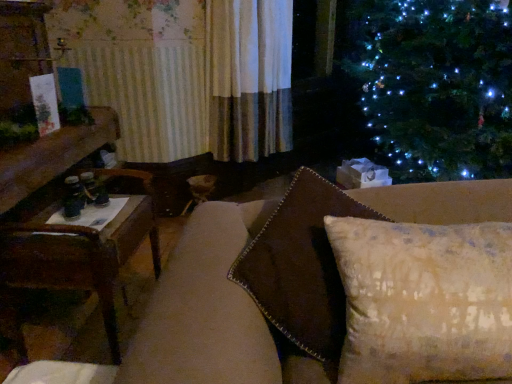
Question: Is textured beige pillow at center with brown wooden table at left?

Choices:
 (A) yes
 (B) no

Answer: (B)

Question: Is textured beige pillow at center to the left of brown wooden table at left from the viewer's perspective?

Choices:
 (A) no
 (B) yes

Answer: (A)

Question: Can you confirm if textured beige pillow at center is smaller than brown wooden table at left?

Choices:
 (A) no
 (B) yes

Answer: (B)

Question: Is textured beige pillow at center positioned with its back to brown wooden table at left?

Choices:
 (A) yes
 (B) no

Answer: (B)

Question: Does textured beige pillow at center have a greater width compared to brown wooden table at left?

Choices:
 (A) yes
 (B) no

Answer: (B)

Question: Would you consider textured beige pillow at center to be distant from brown wooden table at left?

Choices:
 (A) yes
 (B) no

Answer: (B)

Question: Considering the relative sizes of brown wooden table at left and textured beige pillow at center in the image provided, is brown wooden table at left wider than textured beige pillow at center?

Choices:
 (A) yes
 (B) no

Answer: (A)

Question: Is brown wooden table at left not close to textured beige pillow at center?

Choices:
 (A) no
 (B) yes

Answer: (A)

Question: Does brown wooden table at left have a lesser width compared to textured beige pillow at center?

Choices:
 (A) yes
 (B) no

Answer: (B)

Question: Is brown wooden table at left touching textured beige pillow at center?

Choices:
 (A) yes
 (B) no

Answer: (B)

Question: Is brown wooden table at left bigger than textured beige pillow at center?

Choices:
 (A) yes
 (B) no

Answer: (A)

Question: Is brown wooden table at left outside of textured beige pillow at center?

Choices:
 (A) yes
 (B) no

Answer: (A)

Question: Is textured beige pillow at center wider or thinner than brown wooden table at left?

Choices:
 (A) thin
 (B) wide

Answer: (A)